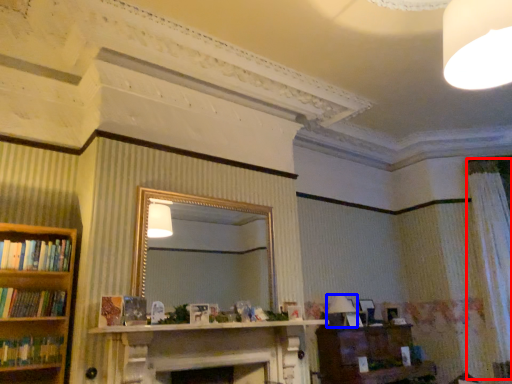
Question: Which point is closer to the camera, curtain (highlighted by a red box) or lamp (highlighted by a blue box)?

Choices:
 (A) curtain
 (B) lamp

Answer: (B)